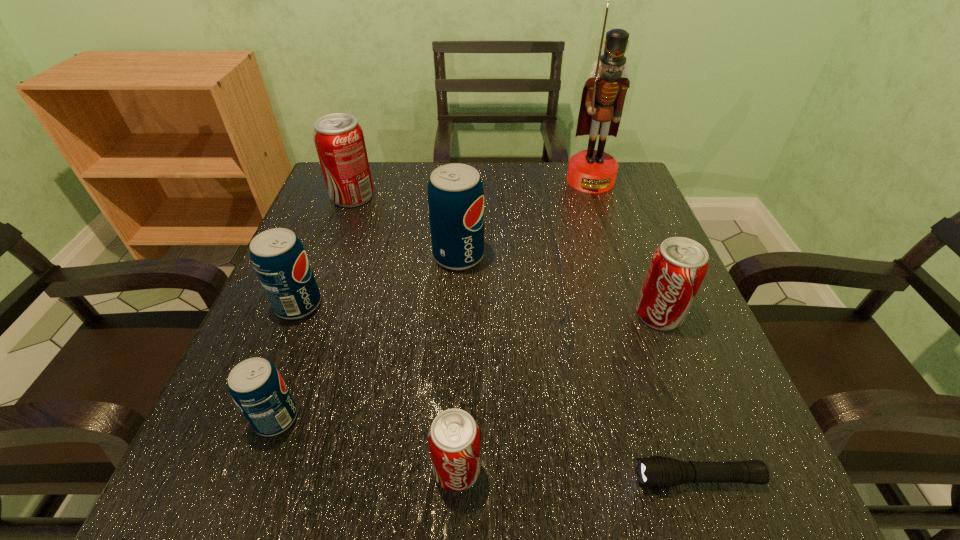
At what (x,y) coordinates should I click in order to perform the action: click on vacant region between the nutcracker and the second biggest red soda can. Please return your answer as a coordinate pair (x, y). Looking at the image, I should click on (625, 247).

You are a GUI agent. You are given a task and a screenshot of the screen. Output one action in this format:
    pyautogui.click(x=<x>, y=<y>)
    Task: Click on the vacant space that's between the second smallest red soda can and the third nearest object
    
    Given the screenshot: What is the action you would take?
    pyautogui.click(x=468, y=366)

Where is `free area in between the second biggest red soda can and the smallest red soda can`? The image size is (960, 540). free area in between the second biggest red soda can and the smallest red soda can is located at coordinates (558, 392).

The image size is (960, 540). Find the location of `unoccupied area between the fifth farthest soda can and the second red soda can from right to left`. unoccupied area between the fifth farthest soda can and the second red soda can from right to left is located at coordinates (367, 444).

Find the location of a particular element. empty space between the rightmost blue pop and the nearest soda can is located at coordinates (458, 363).

Find the location of `empty space that is in between the biggest blue pop and the nearest blue pop`. empty space that is in between the biggest blue pop and the nearest blue pop is located at coordinates (368, 337).

Where is `vacant space that's between the farthest blue pop and the rightmost soda can`? The image size is (960, 540). vacant space that's between the farthest blue pop and the rightmost soda can is located at coordinates (559, 285).

At what (x,y) coordinates should I click in order to perform the action: click on vacant space in between the flashlight and the second farthest blue pop. Please return your answer as a coordinate pair (x, y). Looking at the image, I should click on (498, 392).

Locate an element on the screen. The image size is (960, 540). vacant point located between the flashlight and the farthest red soda can is located at coordinates (525, 337).

Locate which object ranks in proximity to the farthest red soda can. Please provide its 2D coordinates. Your answer should be formatted as a tuple, i.e. [(x, y)], where the tuple contains the x and y coordinates of a point satisfying the conditions above.

[(455, 191)]